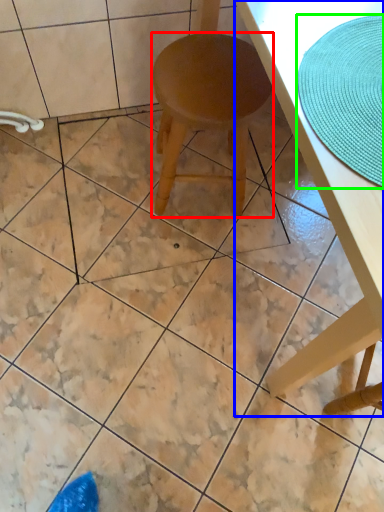
Question: Which object is positioned farthest from stool (highlighted by a red box)? Select from table (highlighted by a blue box) and mat (highlighted by a green box).

Choices:
 (A) table
 (B) mat

Answer: (B)